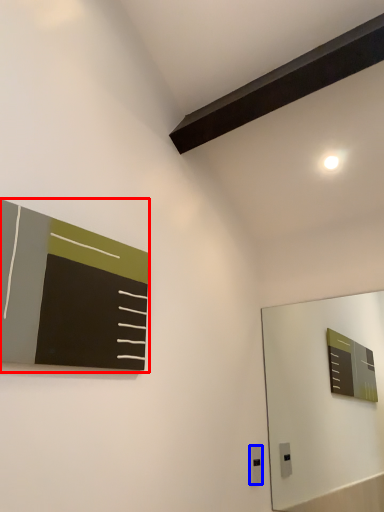
Question: Which object is closer to the camera taking this photo, bulletin board (highlighted by a red box) or electric outlet (highlighted by a blue box)?

Choices:
 (A) bulletin board
 (B) electric outlet

Answer: (A)